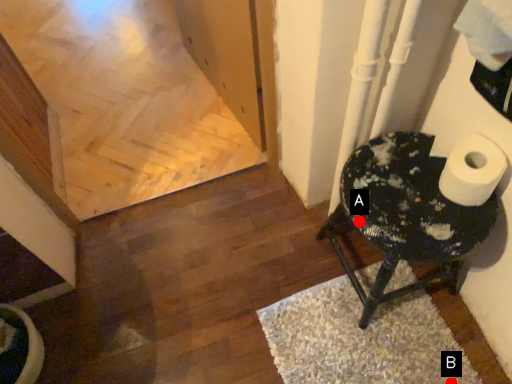
Question: Two points are circled on the image, labeled by A and B beside each circle. Which point is further to the camera?

Choices:
 (A) A is further
 (B) B is further

Answer: (B)